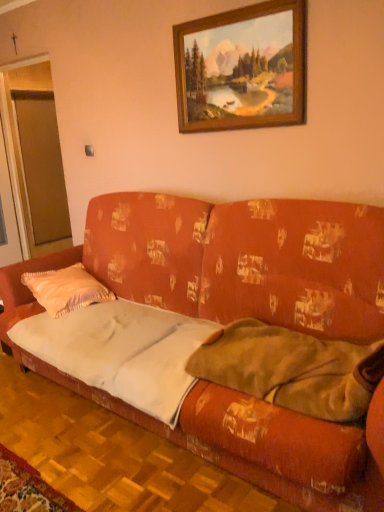
Question: In the image, is velvet orange couch at center positioned in front of or behind satin peach pillow at left?

Choices:
 (A) behind
 (B) front

Answer: (B)

Question: In terms of size, does velvet orange couch at center appear bigger or smaller than satin peach pillow at left?

Choices:
 (A) small
 (B) big

Answer: (B)

Question: Considering the real-world distances, which object is farthest from the soft green blanket at right?

Choices:
 (A) wooden picture frame at upper center
 (B) white fabric sheet at center
 (C) velvet orange couch at center
 (D) transparent glass door at left
 (E) satin peach pillow at left

Answer: (D)

Question: Which is nearer to the velvet orange couch at center?

Choices:
 (A) white fabric sheet at center
 (B) soft green blanket at right
 (C) transparent glass door at left
 (D) satin peach pillow at left
 (E) wooden picture frame at upper center

Answer: (A)